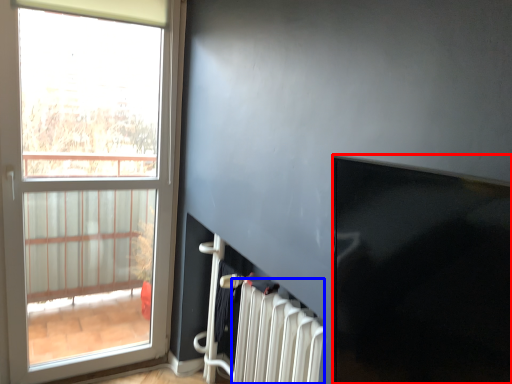
Question: Among these objects, which one is nearest to the camera, window screen (highlighted by a red box) or radiator (highlighted by a blue box)?

Choices:
 (A) window screen
 (B) radiator

Answer: (A)